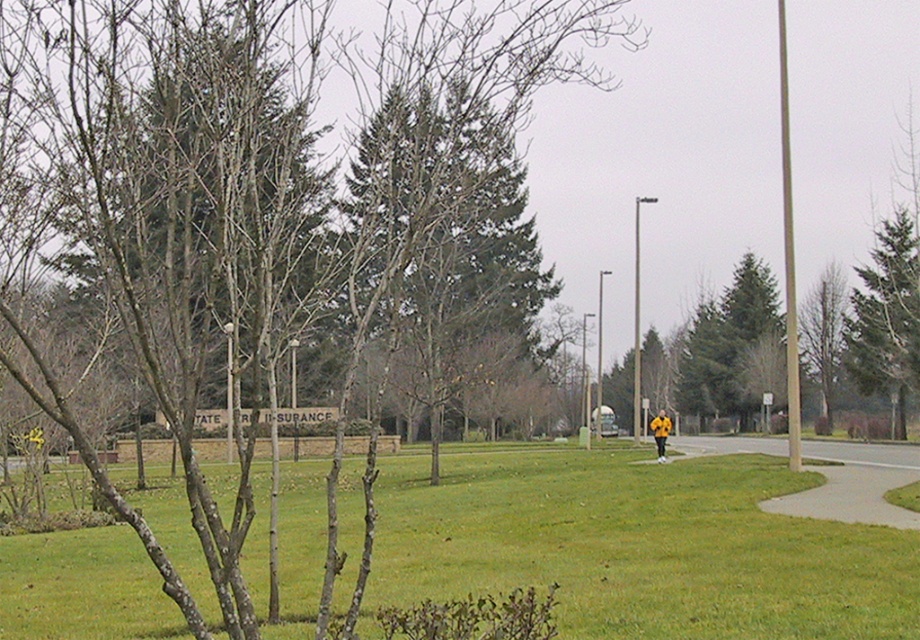
Is smooth bark tree at center behind green grass at center?

No, smooth bark tree at center is closer to the viewer.

Does point (450, 92) come in front of point (897, 602)?

That is True.

Between point (170, 4) and point (532, 486), which one is positioned behind?

Positioned behind is point (532, 486).

The image size is (920, 640). In order to click on smooth bark tree at center in this screenshot , I will do `click(242, 205)`.

Between green textured tree at upper right and concrete sidewalk at lower right, which one appears on the left side from the viewer's perspective?

concrete sidewalk at lower right is more to the left.

Does point (874, 260) lie behind point (876, 518)?

Yes.

Measure the distance between point (878, 372) and camera.

Point (878, 372) and camera are 56.25 meters apart.

Identify the location of green textured tree at upper right. The width and height of the screenshot is (920, 640). tap(886, 317).

Between point (894, 435) and point (654, 429), which one is positioned behind?

Positioned behind is point (894, 435).

Between green textured tree at upper right and yellow matte jacket at center, which one has more height?

green textured tree at upper right is taller.

Is point (871, 316) positioned after point (667, 422)?

Yes, it is.

The height and width of the screenshot is (640, 920). Find the location of `green textured tree at upper right`. green textured tree at upper right is located at coordinates (886, 317).